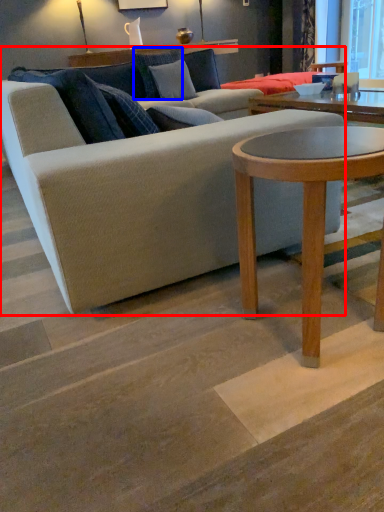
Question: Which of the following is the closest to the observer, studio couch (highlighted by a red box) or pillow (highlighted by a blue box)?

Choices:
 (A) studio couch
 (B) pillow

Answer: (A)